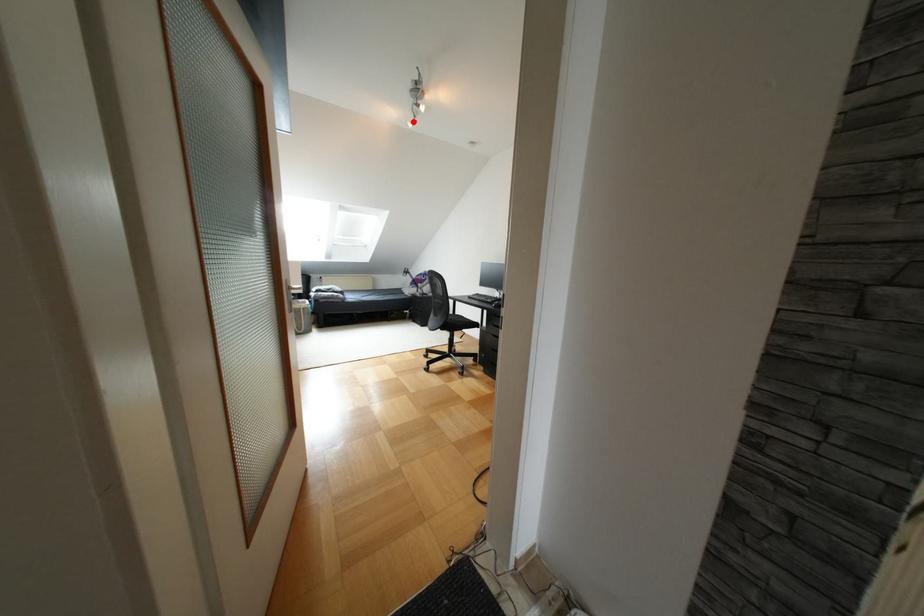
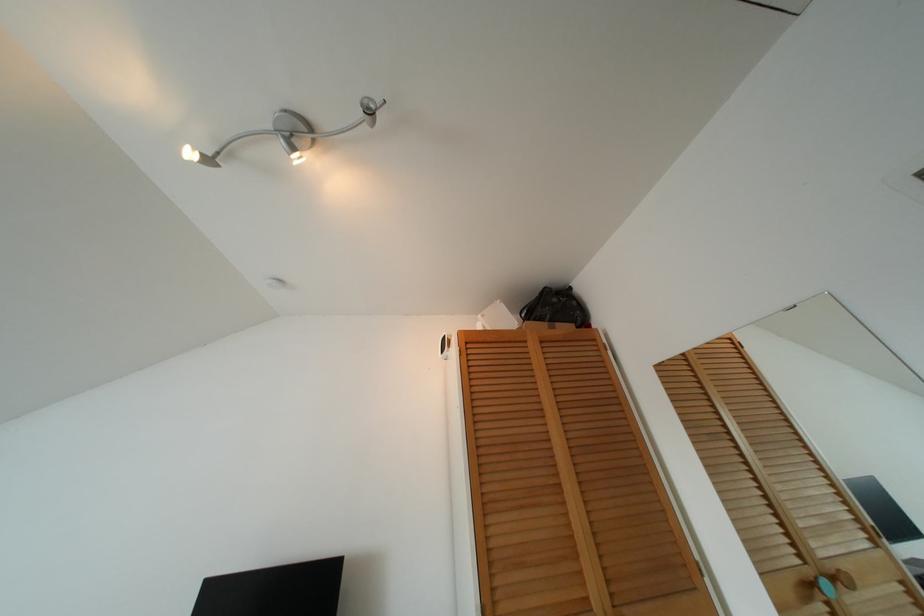
Where in the second image is the point corresponding to the highlighted location from the first image?

(208, 160)